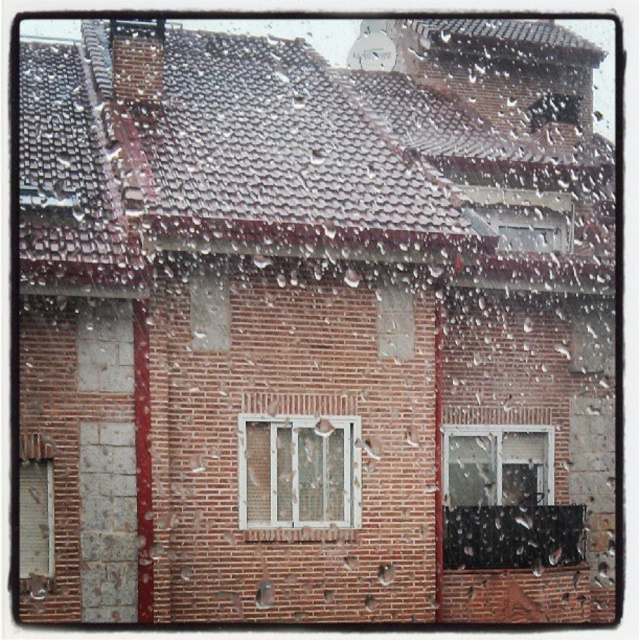
Does point (278, 420) lie behind point (538, 480)?

No, (278, 420) is in front of (538, 480).

Can you confirm if white plastic window at center is positioned to the right of clear glass window at center?

No, white plastic window at center is not to the right of clear glass window at center.

Who is more forward, (310, 518) or (449, 426)?

Point (310, 518) is in front.

Locate an element on the screen. white plastic window at center is located at coordinates (298, 472).